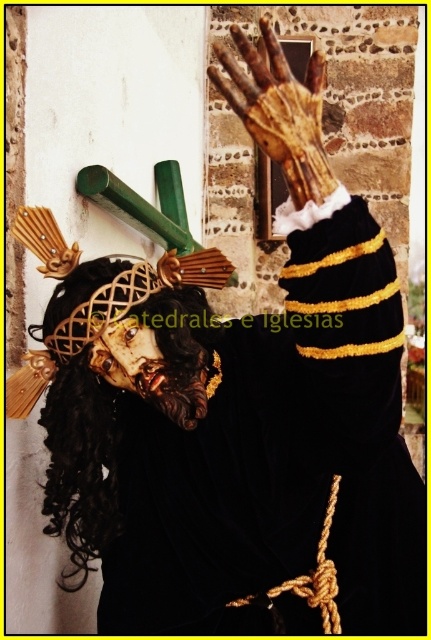
Question: Which of the following is the closest to the observer?

Choices:
 (A) wooden hand at upper center
 (B) black curly wig at left

Answer: (A)

Question: Can you confirm if black curly wig at left is thinner than wooden hand at upper center?

Choices:
 (A) yes
 (B) no

Answer: (B)

Question: Which of the following is the farthest from the observer?

Choices:
 (A) (65, 394)
 (B) (318, 163)

Answer: (A)

Question: Does black curly wig at left have a greater width compared to wooden hand at upper center?

Choices:
 (A) yes
 (B) no

Answer: (A)

Question: Is black curly wig at left closer to the viewer compared to wooden hand at upper center?

Choices:
 (A) no
 (B) yes

Answer: (A)